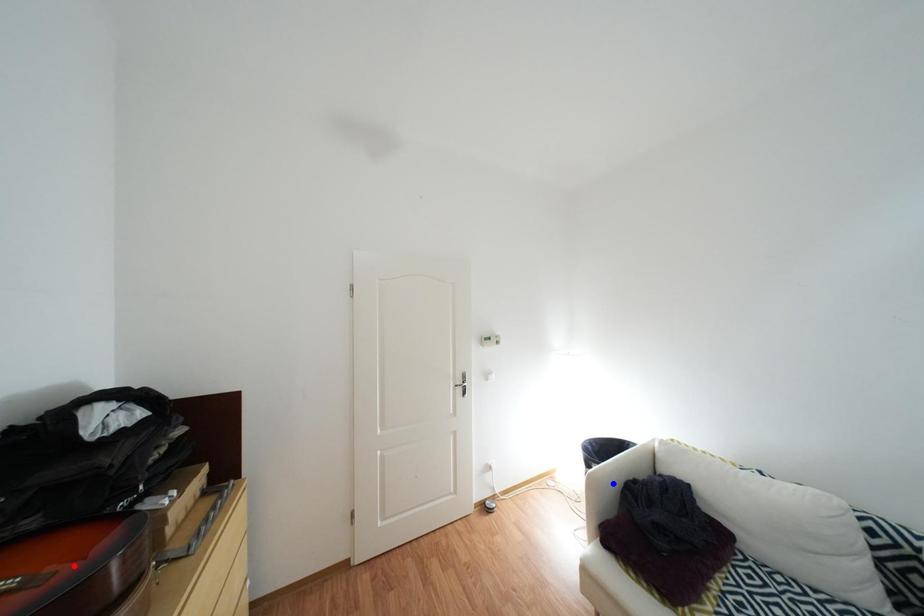
Question: Two points are marked on the image. Which point is closer to the camera?

Choices:
 (A) Blue point is closer.
 (B) Red point is closer.

Answer: (B)